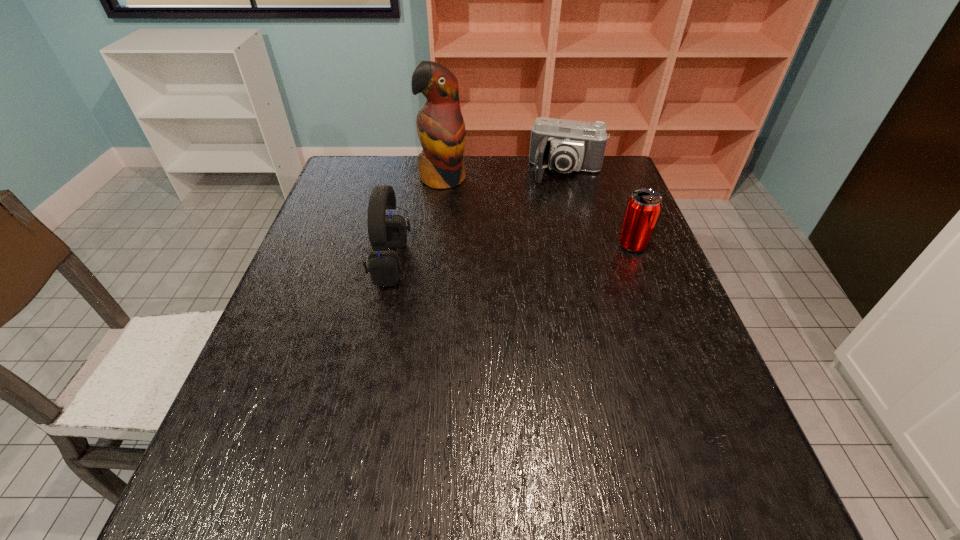
This screenshot has height=540, width=960. What are the coordinates of `the third shortest object` in the screenshot? It's located at (385, 231).

Image resolution: width=960 pixels, height=540 pixels. I want to click on soda can, so [x=644, y=206].

The image size is (960, 540). I want to click on camera, so click(x=563, y=145).

This screenshot has width=960, height=540. Identify the location of parrot. (440, 125).

You are a GUI agent. You are given a task and a screenshot of the screen. Output one action in this format:
    pyautogui.click(x=<x>, y=<y>)
    Task: Click on the free spot located on the headband of the third shortest object
    This screenshot has width=960, height=540.
    Given the screenshot: What is the action you would take?
    click(x=349, y=262)

Find the location of a particular element. This screenshot has height=540, width=960. blank area located on the headband of the third shortest object is located at coordinates (342, 262).

The image size is (960, 540). What are the coordinates of `vacant area situated on the back of the soda can` in the screenshot? It's located at (618, 207).

Identify the location of vacant space positioned 0.320m at the front of the camera with an open lens cover. (543, 253).

The width and height of the screenshot is (960, 540). I want to click on free spot located at the front of the camera with an open lens cover, so click(555, 207).

Locate an element on the screen. This screenshot has height=540, width=960. free space located at the front of the camera with an open lens cover is located at coordinates click(556, 203).